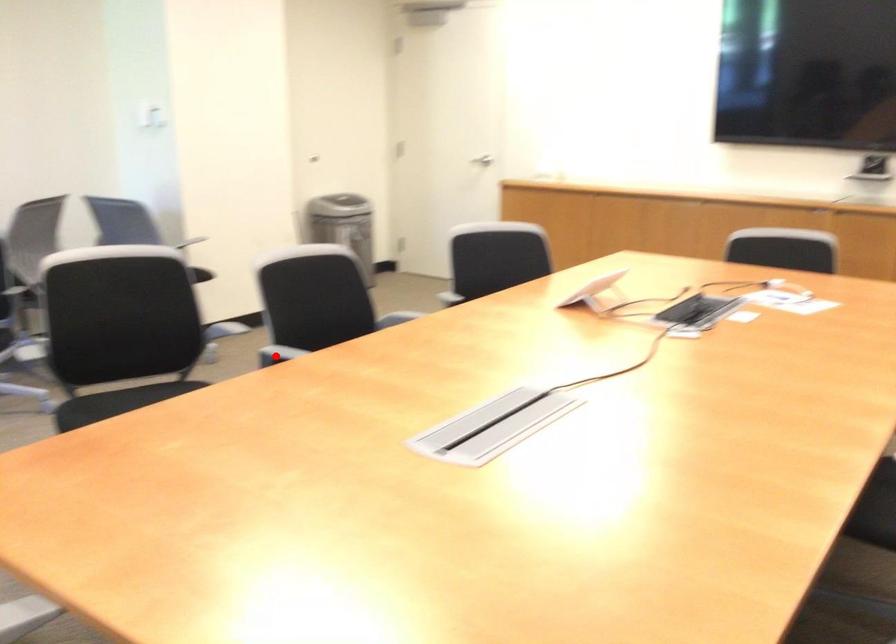
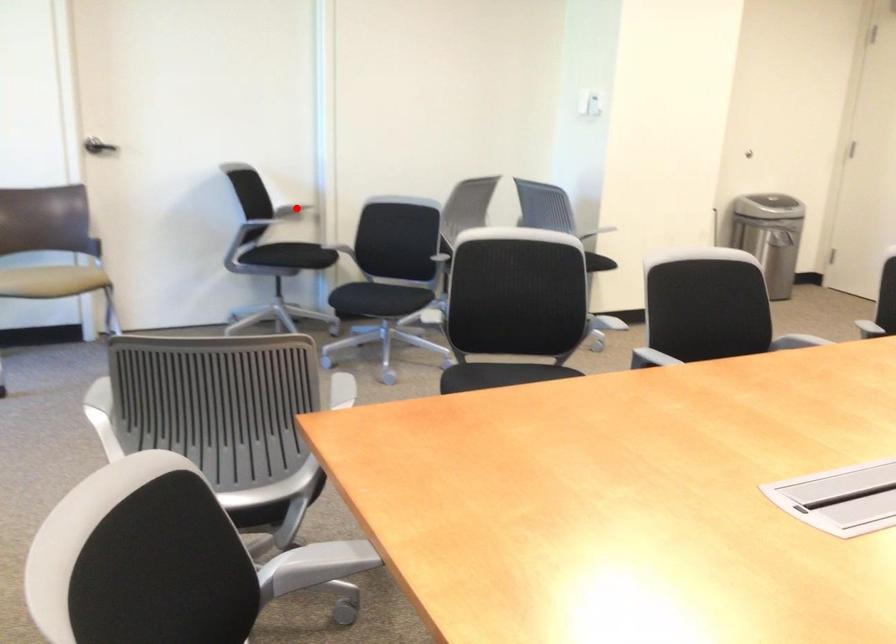
I am providing you with two images of the same scene from different viewpoints. A red point is marked on the first image and another point is marked on the second image. Is the red point in image1 aligned with the point shown in image2?

No